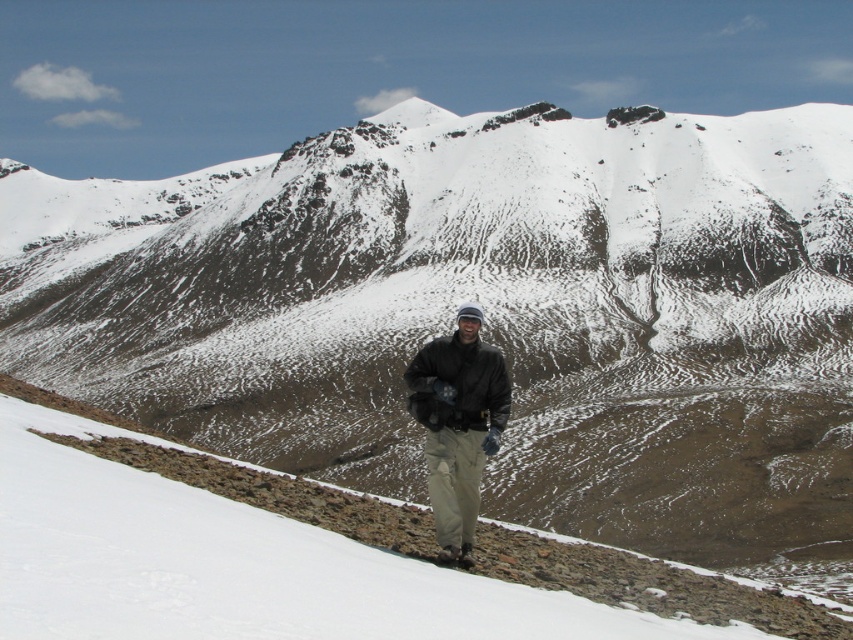
Consider the image. Can you confirm if white snow at center is wider than black matte jacket at center?

Indeed, white snow at center has a greater width compared to black matte jacket at center.

Which is more to the right, white snow at center or black matte jacket at center?

black matte jacket at center

Consider the image. Measure the distance between point (x=15, y=456) and camera.

Point (x=15, y=456) is 37.92 meters from camera.

Image resolution: width=853 pixels, height=640 pixels. I want to click on white snow at center, so click(x=305, y=556).